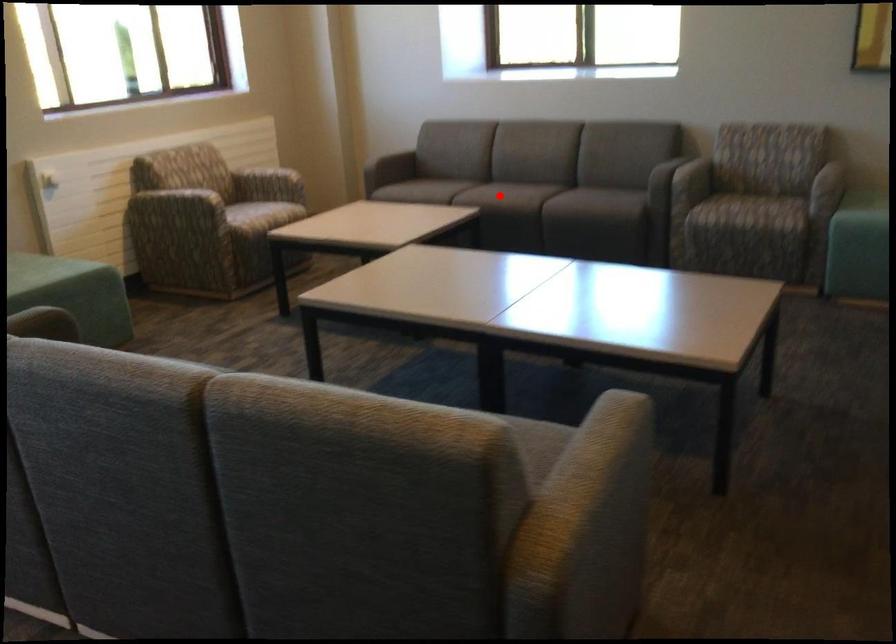
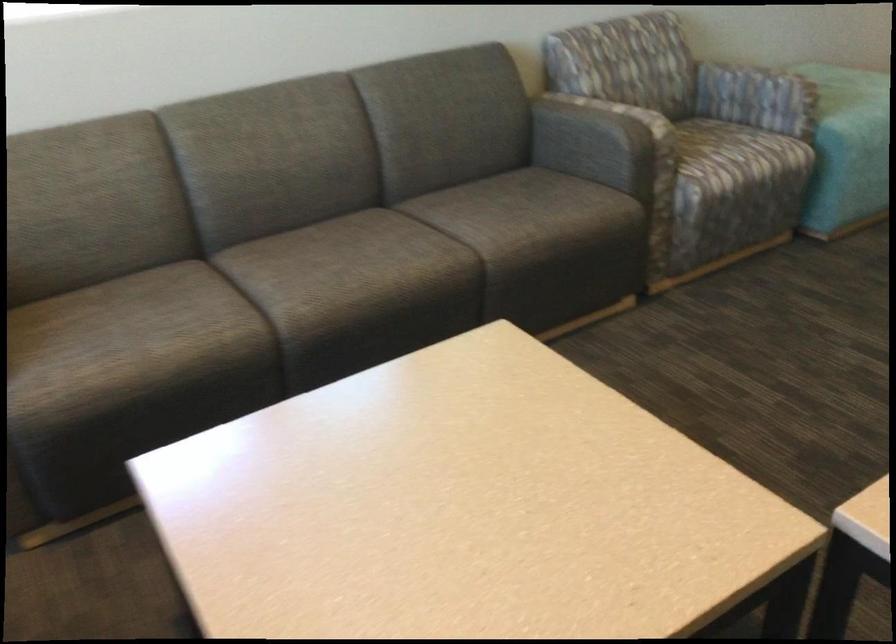
Find the pixel in the second image that matches the highlighted location in the first image.

(427, 269)